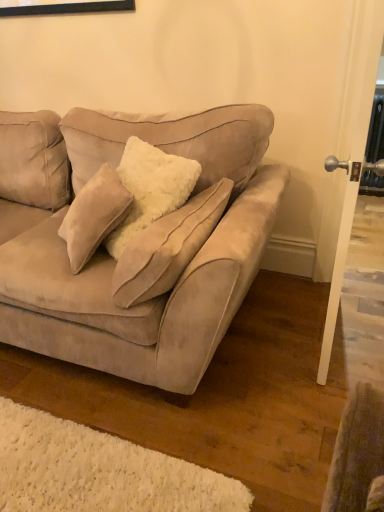
What do you see at coordinates (115, 262) in the screenshot?
I see `suede beige couch at center` at bounding box center [115, 262].

Find the location of a particular element. The image size is (384, 512). suede beige couch at center is located at coordinates point(115,262).

You are a GUI agent. You are given a task and a screenshot of the screen. Output one action in this format:
    pyautogui.click(x=<x>, y=<y>)
    Task: Click on the white glossy door handle at right
    
    Given the screenshot: What is the action you would take?
    pyautogui.click(x=347, y=159)

What do you see at coordinates (347, 159) in the screenshot? I see `white glossy door handle at right` at bounding box center [347, 159].

What is the approximate width of white glossy door handle at right?

7.18 inches.

The width and height of the screenshot is (384, 512). I want to click on suede beige couch at center, so click(x=115, y=262).

In the image, is white glossy door handle at right on the left side or the right side of suede beige couch at center?

white glossy door handle at right is to the right of suede beige couch at center.

Based on the photo, considering the positions of objects white glossy door handle at right and suede beige couch at center in the image provided, who is behind, white glossy door handle at right or suede beige couch at center?

white glossy door handle at right is further from the camera.

Based on the photo, which is further, (368,1) or (62,335)?

The point (368,1) is behind.

From the image's perspective, is white glossy door handle at right located above suede beige couch at center?

Correct, white glossy door handle at right appears higher than suede beige couch at center in the image.

From a real-world perspective, which object rests below the other?

suede beige couch at center is physically lower.

Which of these two, white glossy door handle at right or suede beige couch at center, is thinner?

white glossy door handle at right.

Who is shorter, white glossy door handle at right or suede beige couch at center?

suede beige couch at center.

Between white glossy door handle at right and suede beige couch at center, which one has smaller size?

white glossy door handle at right is smaller.

Would you say white glossy door handle at right contains suede beige couch at center?

Definitely not — suede beige couch at center is not inside white glossy door handle at right.

Is white glossy door handle at right placed right next to suede beige couch at center?

white glossy door handle at right and suede beige couch at center are not in contact.

Looking at this image, is white glossy door handle at right looking in the opposite direction of suede beige couch at center?

Yes.

How different are the orientations of white glossy door handle at right and suede beige couch at center in degrees?

The angular difference between white glossy door handle at right and suede beige couch at center is 90 degrees.

What are the coordinates of `studio couch that is on the left side of white glossy door handle at right` in the screenshot? It's located at (115, 262).

Does suede beige couch at center appear on the left side of white glossy door handle at right?

Yes.

Is suede beige couch at center in front of white glossy door handle at right?

Yes.

Is point (275, 186) farther from camera compared to point (340, 174)?

No, it is in front of (340, 174).

From the image's perspective, is suede beige couch at center under white glossy door handle at right?

Yes.

From a real-world perspective, is suede beige couch at center on white glossy door handle at right?

No, from a real-world perspective, suede beige couch at center is not above white glossy door handle at right.

Which of these two, suede beige couch at center or white glossy door handle at right, is wider?

With larger width is suede beige couch at center.

Considering the relative sizes of suede beige couch at center and white glossy door handle at right in the image provided, is suede beige couch at center taller than white glossy door handle at right?

No.

Based on the photo, does suede beige couch at center have a smaller size compared to white glossy door handle at right?

Actually, suede beige couch at center might be larger than white glossy door handle at right.

Is white glossy door handle at right inside suede beige couch at center?

No, suede beige couch at center does not contain white glossy door handle at right.

Is suede beige couch at center not close to white glossy door handle at right?

No, suede beige couch at center is in close proximity to white glossy door handle at right.

Is suede beige couch at center looking in the opposite direction of white glossy door handle at right?

No, suede beige couch at center's orientation is not away from white glossy door handle at right.

What's the angular difference between suede beige couch at center and white glossy door handle at right's facing directions?

suede beige couch at center and white glossy door handle at right are facing 90 degrees away from each other.

How far apart are suede beige couch at center and white glossy door handle at right?

suede beige couch at center is 71.80 centimeters from white glossy door handle at right.

Find the location of a particular element. This screenshot has height=512, width=384. studio couch below the white glossy door handle at right (from a real-world perspective) is located at coordinates (115, 262).

Where is `screen door that appears behind the suede beige couch at center`? screen door that appears behind the suede beige couch at center is located at coordinates (347, 159).

Identify the location of screen door above the suede beige couch at center (from the image's perspective). (347, 159).